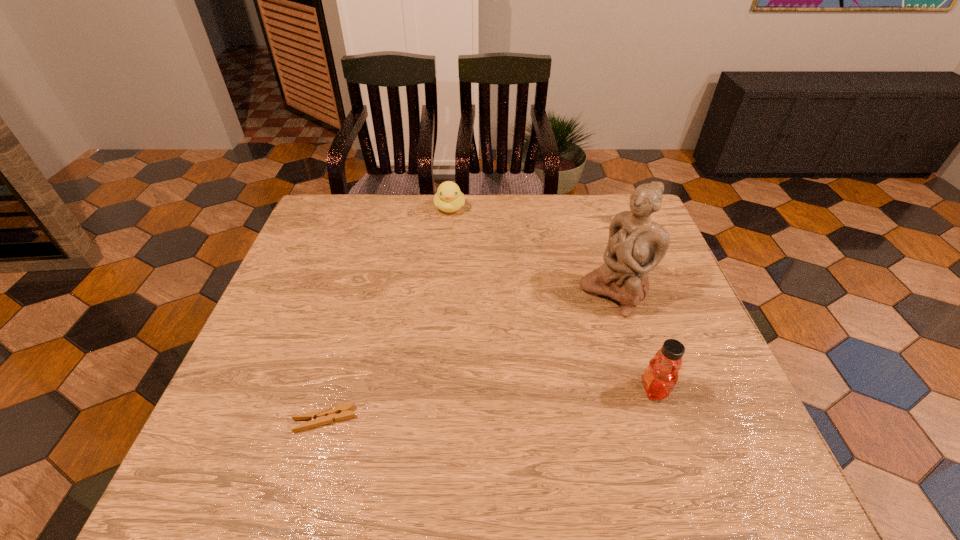
Locate an element on the screen. The width and height of the screenshot is (960, 540). vacant space located on the front label of the third shortest object is located at coordinates (452, 389).

Identify the location of vacant space located on the front label of the third shortest object. The width and height of the screenshot is (960, 540). (485, 389).

I want to click on vacant space located 0.220m on the front-facing side of the tallest object, so click(533, 358).

This screenshot has width=960, height=540. I want to click on free spot located on the front-facing side of the tallest object, so click(578, 322).

The width and height of the screenshot is (960, 540). What are the coordinates of `blank space located on the front-facing side of the tallest object` in the screenshot? It's located at (550, 344).

Image resolution: width=960 pixels, height=540 pixels. Find the location of `blank space located at the beak of the duckling`. blank space located at the beak of the duckling is located at coordinates (450, 251).

Locate an element on the screen. Image resolution: width=960 pixels, height=540 pixels. free point located 0.100m at the beak of the duckling is located at coordinates (450, 238).

This screenshot has height=540, width=960. Identify the location of vacant space situated at the beak of the duckling. (450, 251).

Locate an element on the screen. The width and height of the screenshot is (960, 540). object that is at the far edge is located at coordinates (449, 198).

The width and height of the screenshot is (960, 540). Find the location of `clothespin situated at the near edge`. clothespin situated at the near edge is located at coordinates (317, 418).